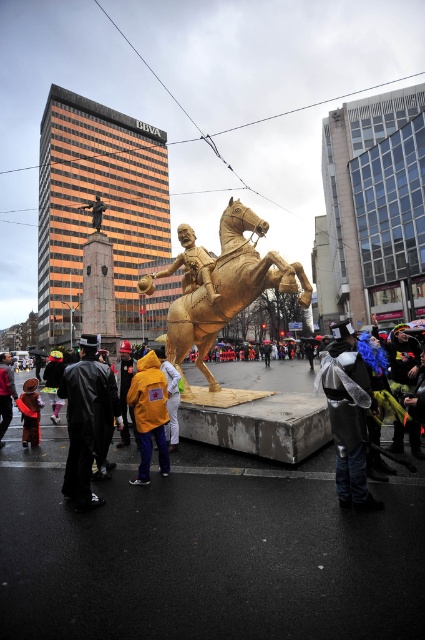
Question: Which object is positioned closest to the black leather coat at lower left?

Choices:
 (A) gold metallic horse at center
 (B) yellow fabric coat at center
 (C) yellow matte jacket at center

Answer: (C)

Question: Does denim jacket at lower right appear under black leather coat at lower left?

Choices:
 (A) yes
 (B) no

Answer: (A)

Question: Which of the following is the closest to the observer?

Choices:
 (A) (176, 376)
 (B) (78, 451)
 (C) (357, 429)

Answer: (C)

Question: Can you confirm if gold metallic horse at center is wider than yellow fabric coat at center?

Choices:
 (A) no
 (B) yes

Answer: (B)

Question: Does yellow matte jacket at center appear over yellow fabric coat at center?

Choices:
 (A) yes
 (B) no

Answer: (A)

Question: Which object is the closest to the denim jacket at lower right?

Choices:
 (A) black leather coat at lower left
 (B) yellow matte jacket at center
 (C) gold metallic horse at center
 (D) velvet red coat at lower left

Answer: (B)